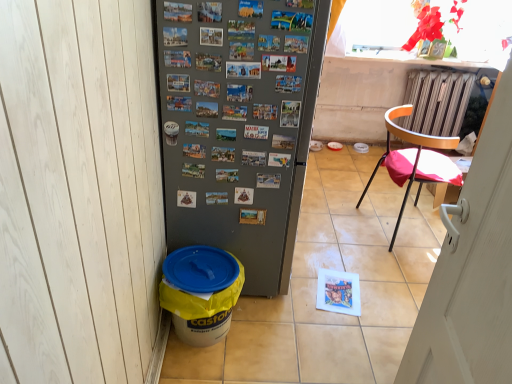
Question: Considering their positions, is wooden chair with red cushion at right located in front of or behind orange plastic chair at right?

Choices:
 (A) behind
 (B) front

Answer: (B)

Question: Is wooden chair with red cushion at right to the left or to the right of orange plastic chair at right in the image?

Choices:
 (A) left
 (B) right

Answer: (A)

Question: Estimate the real-world distances between objects in this image. Which object is farther from the orange plastic chair at right?

Choices:
 (A) wooden chair with red cushion at right
 (B) translucent plastic window screen at upper right
 (C) yellow plastic bucket at lower left
 (D) satin silver refrigerator at center

Answer: (C)

Question: Which object is the farthest from the translucent plastic window screen at upper right?

Choices:
 (A) yellow plastic bucket at lower left
 (B) orange plastic chair at right
 (C) satin silver refrigerator at center
 (D) wooden chair with red cushion at right

Answer: (A)